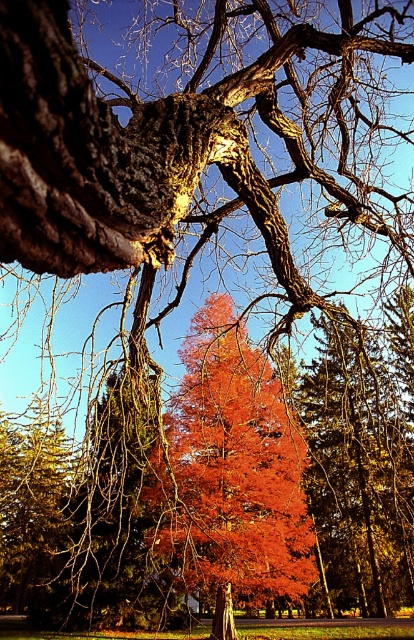
You are an artist trying to paint the scene. You want to ensure that the vivid orange leaves at center and the smooth bark tree trunk at center are proportionally accurate. Which object should you paint taller?

The vivid orange leaves at center should be painted taller since they are taller than the smooth bark tree trunk at center according to the description.

You are an artist trying to sketch this scene. You want to ensure the vivid orange leaves at center and the smooth bark tree trunk at center are positioned correctly. Based on the scene, which object should be drawn to the left side of the other?

The vivid orange leaves at center should be drawn to the left of the smooth bark tree trunk at center according to the description.

You are standing in a forest and want to take a photo of the vivid orange leaves at center and the smooth bark tree trunk at center. If you want both objects to be in focus, which one should you focus on first? Please explain your reasoning based on their distance from each other and the camera.

To ensure both the vivid orange leaves at center and the smooth bark tree trunk at center are in focus, you should focus on the smooth bark tree trunk at center first. Since it is closer to the camera than the vivid orange leaves at center, focusing on the closer object allows the depth of field to extend backward, potentially covering both subjects.